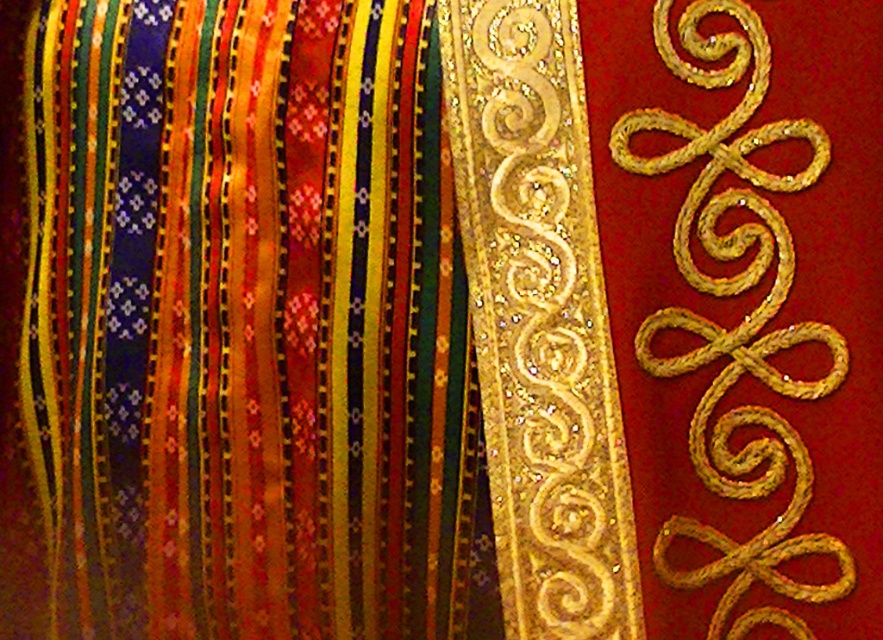
You are an interior designer planning to place a new decorative element in the scene. The element needs to be positioned exactly at the coordinates given for the shiny metallic ribbons at left. Where should you place it?

You should place the new decorative element at the coordinates specified for the shiny metallic ribbons at left, which is at point (238, 326).

You are an interior designer arranging a display. You need to place a new decorative item in front of the shiny metallic ribbons at left and the gold glittery swirls at right. Which object should you place it in front of to ensure it is visible from the front view?

You should place the new decorative item in front of the gold glittery swirls at right because the shiny metallic ribbons at left are in front of them, so placing it in front of the gold glittery swirls at right would keep it visible from the front view.

You are an interior designer planning to hang a decorative piece. You have two elements to consider from the image provided. The shiny metallic ribbons at left and the gold glittery swirls at right. Which of these two elements has a larger size in the image?

The shiny metallic ribbons at left is bigger than gold glittery swirls at right, so the shiny metallic ribbons at left has a larger size in the image.